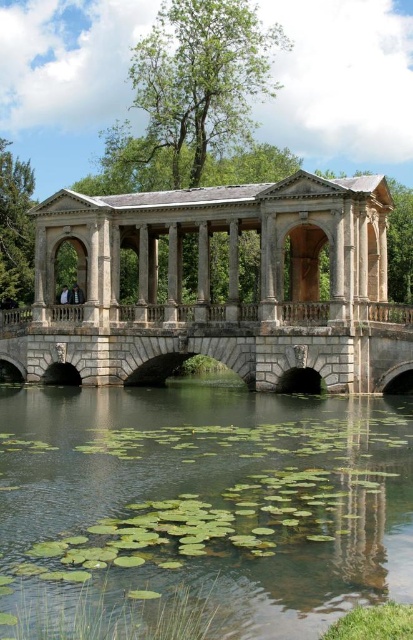
Who is higher up, stone gazebo at center or stone arch bridge at center?

Positioned higher is stone gazebo at center.

Can you confirm if stone gazebo at center is positioned to the left of stone arch bridge at center?

Incorrect, stone gazebo at center is not on the left side of stone arch bridge at center.

Locate an element on the screen. stone gazebo at center is located at coordinates (227, 289).

I want to click on stone gazebo at center, so click(x=227, y=289).

Can you confirm if green leafy water at center is thinner than stone arch bridge at center?

Indeed, green leafy water at center has a lesser width compared to stone arch bridge at center.

Does point (101, 529) lie in front of point (379, 355)?

Yes, point (101, 529) is closer to viewer.

Which is in front, point (135, 493) or point (104, 333)?

Positioned in front is point (135, 493).

This screenshot has height=640, width=413. I want to click on green leafy water at center, so 199,509.

Can you confirm if green leafy water at center is positioned to the right of stone gazebo at center?

No, green leafy water at center is not to the right of stone gazebo at center.

Which is below, green leafy water at center or stone gazebo at center?

green leafy water at center is lower down.

Between point (291, 440) and point (294, 195), which one is positioned behind?

Point (294, 195)

At what (x,y) coordinates should I click in order to perform the action: click on green leafy water at center. Please return your answer as a coordinate pair (x, y). Looking at the image, I should click on (199, 509).